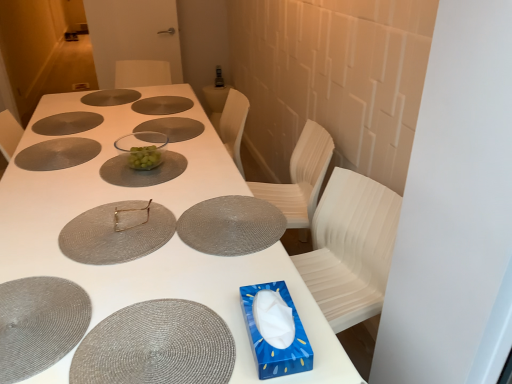
Locate an element on the screen. vacant area on the back side of blue paper tissue box at lower right is located at coordinates (254, 273).